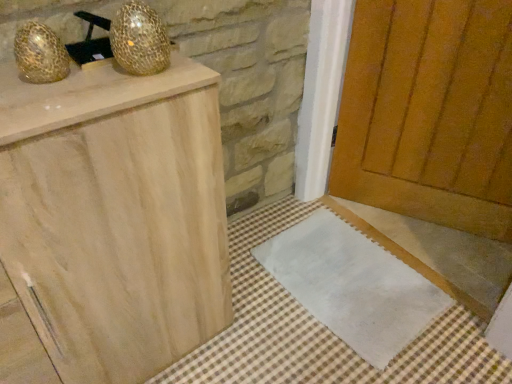
Image resolution: width=512 pixels, height=384 pixels. Find the location of `free space in front of gold mesh disco ball at upper left, the first disco ball when ordered from right to left`. free space in front of gold mesh disco ball at upper left, the first disco ball when ordered from right to left is located at coordinates (112, 89).